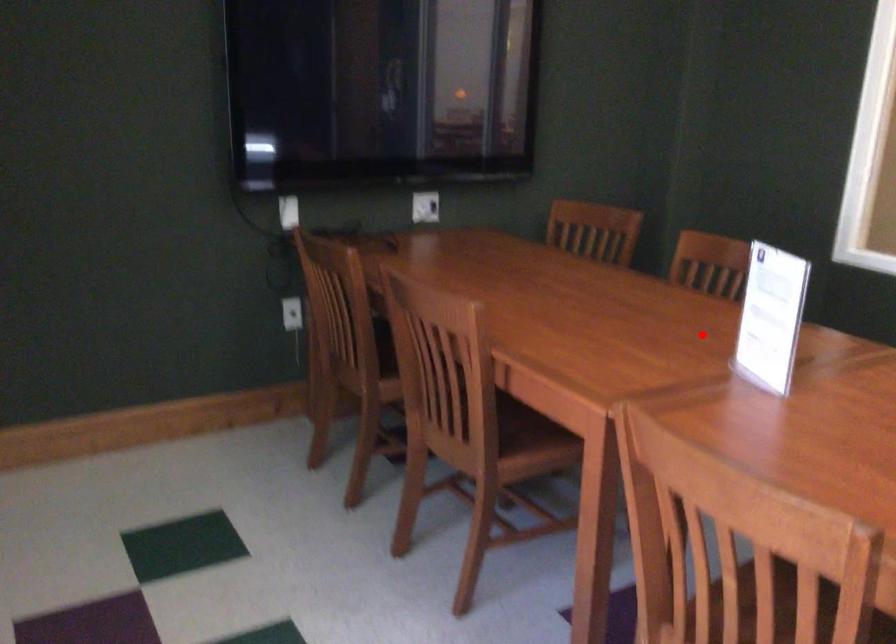
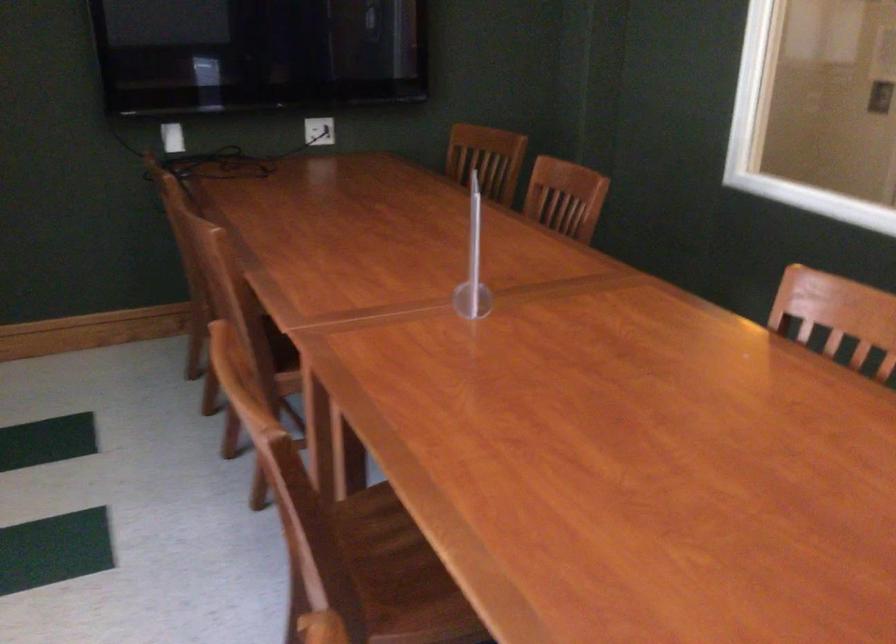
Where in the second image is the point corresponding to the highlighted location from the first image?

(472, 263)